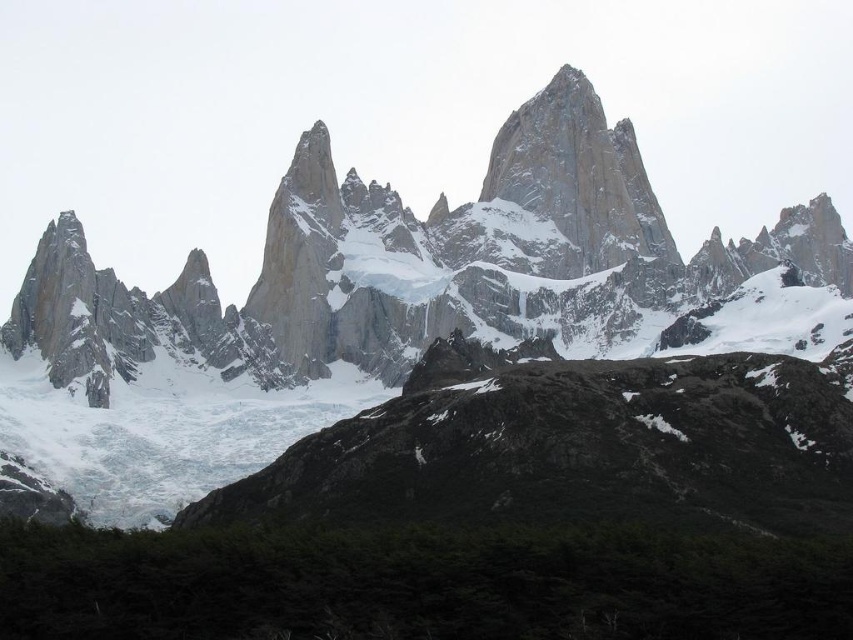
Can you confirm if granite rock formation at center is bigger than white snow-covered peak at center?

Yes, granite rock formation at center is bigger than white snow-covered peak at center.

Is granite rock formation at center below white snow-covered peak at center?

Yes.

Measure the distance between point (x=106, y=291) and camera.

Point (x=106, y=291) is 133.66 meters from camera.

At what (x,y) coordinates should I click in order to perform the action: click on granite rock formation at center. Please return your answer as a coordinate pair (x, y). The height and width of the screenshot is (640, 853). Looking at the image, I should click on 416,262.